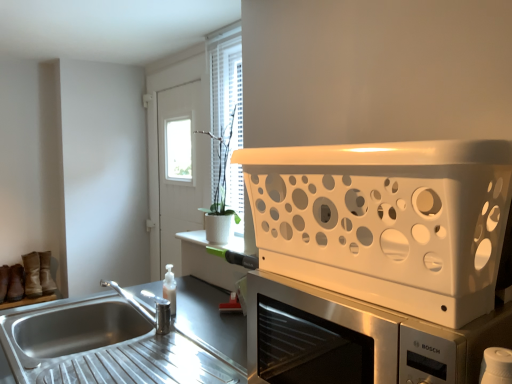
Question: Does brown leather shoe at lower left, arranged as the second shoe when viewed from the left, have a greater width compared to white matte microwave oven at upper right?

Choices:
 (A) no
 (B) yes

Answer: (A)

Question: From a real-world perspective, does brown leather shoe at lower left, arranged as the second shoe when viewed from the left, sit lower than white matte microwave oven at upper right?

Choices:
 (A) yes
 (B) no

Answer: (A)

Question: Is white matte microwave oven at upper right located within brown leather shoe at lower left, arranged as the second shoe when viewed from the left?

Choices:
 (A) no
 (B) yes

Answer: (A)

Question: Is brown leather shoe at lower left, arranged as the second shoe when viewed from the left, not within white matte microwave oven at upper right?

Choices:
 (A) no
 (B) yes

Answer: (B)

Question: Does brown leather shoe at lower left, arranged as the second shoe when viewed from the left, have a greater height compared to white matte microwave oven at upper right?

Choices:
 (A) yes
 (B) no

Answer: (B)

Question: Is brown leather shoe at lower left, marked as the 2th shoe in a right-to-left arrangement, smaller than white matte microwave oven at upper right?

Choices:
 (A) no
 (B) yes

Answer: (B)

Question: Does stainless steel sink at lower left turn towards brown leather shoe at lower left, arranged as the second shoe when viewed from the left?

Choices:
 (A) yes
 (B) no

Answer: (B)

Question: Is stainless steel sink at lower left outside of brown leather shoe at lower left, marked as the 2th shoe in a right-to-left arrangement?

Choices:
 (A) no
 (B) yes

Answer: (B)

Question: Is stainless steel sink at lower left touching brown leather shoe at lower left, marked as the 2th shoe in a right-to-left arrangement?

Choices:
 (A) yes
 (B) no

Answer: (B)

Question: Is stainless steel sink at lower left facing away from brown leather shoe at lower left, marked as the 2th shoe in a right-to-left arrangement?

Choices:
 (A) yes
 (B) no

Answer: (B)

Question: Can you confirm if stainless steel sink at lower left is positioned to the left of brown leather shoe at lower left, marked as the 2th shoe in a right-to-left arrangement?

Choices:
 (A) no
 (B) yes

Answer: (A)

Question: Considering the relative positions of stainless steel sink at lower left and brown leather shoe at lower left, marked as the 2th shoe in a right-to-left arrangement, in the image provided, is stainless steel sink at lower left behind brown leather shoe at lower left, marked as the 2th shoe in a right-to-left arrangement,?

Choices:
 (A) yes
 (B) no

Answer: (B)

Question: Can you confirm if white matte microwave oven at upper right is wider than white plastic basket at upper right?

Choices:
 (A) yes
 (B) no

Answer: (B)